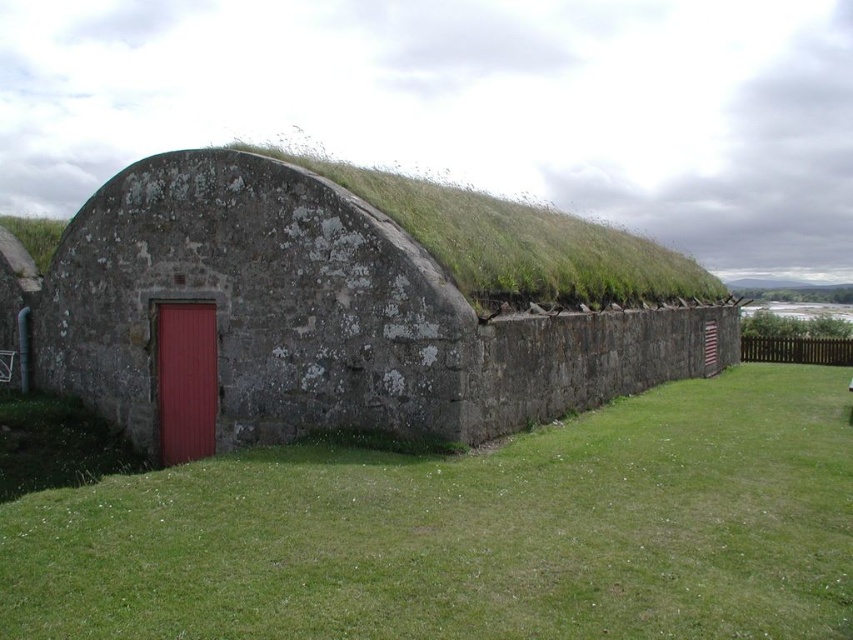
Question: Which of the following is the farthest from the observer?

Choices:
 (A) (793, 426)
 (B) (161, 232)

Answer: (B)

Question: Can you confirm if green grass at center is smaller than rustic stone hut at center?

Choices:
 (A) yes
 (B) no

Answer: (A)

Question: Is green grass at center positioned in front of rustic stone hut at center?

Choices:
 (A) no
 (B) yes

Answer: (B)

Question: Does green grass at center appear on the left side of rustic stone hut at center?

Choices:
 (A) yes
 (B) no

Answer: (B)

Question: Among these points, which one is nearest to the camera?

Choices:
 (A) (364, 404)
 (B) (293, 499)

Answer: (B)